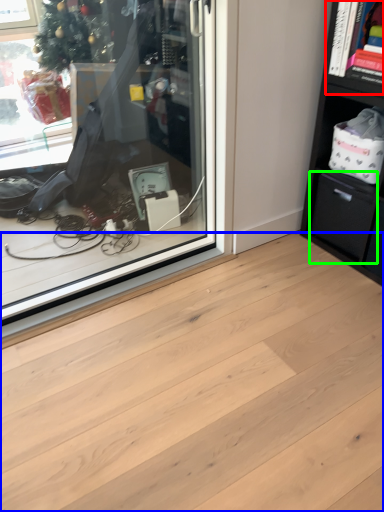
Question: Which object is positioned farthest from cabinet (highlighted by a red box)? Select from plank (highlighted by a blue box) and drawer (highlighted by a green box).

Choices:
 (A) plank
 (B) drawer

Answer: (A)